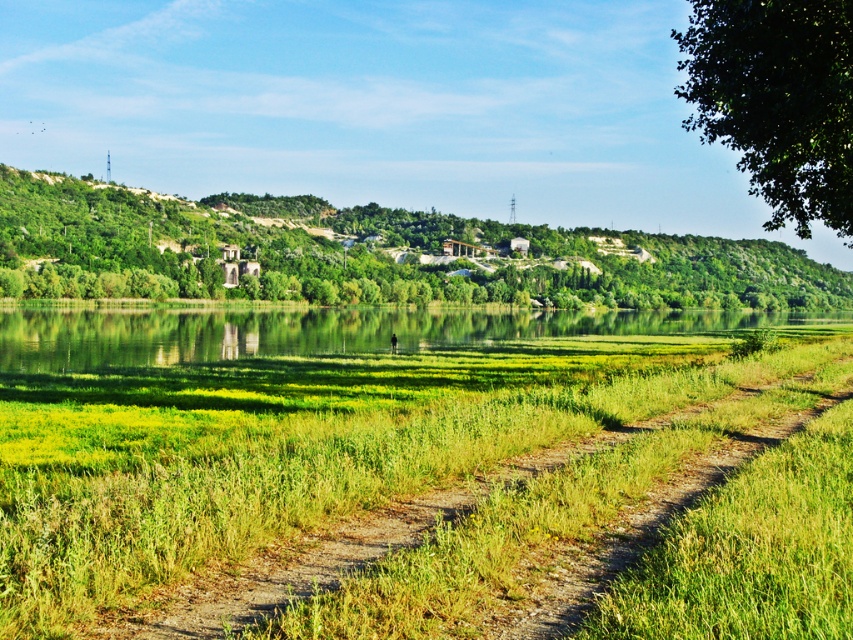
Is green leafy hill at upper center wider than green grassy river at center?

Correct, the width of green leafy hill at upper center exceeds that of green grassy river at center.

Does green leafy hill at upper center have a smaller size compared to green grassy river at center?

Actually, green leafy hill at upper center might be larger than green grassy river at center.

Who is more forward, (822, 296) or (608, 324)?

Positioned in front is point (608, 324).

Where is `green leafy hill at upper center`? The width and height of the screenshot is (853, 640). green leafy hill at upper center is located at coordinates (369, 253).

How distant is green grassy at center from green grassy river at center?

61.33 meters

Does green grassy at center lie in front of green grassy river at center?

Yes.

Does point (173, 561) come behind point (297, 317)?

That is False.

Image resolution: width=853 pixels, height=640 pixels. Identify the location of green grassy at center. (361, 484).

Which is behind, point (120, 595) or point (737, 292)?

The point (737, 292) is more distant.

Does green grassy at center appear under green leafy hill at upper center?

Correct, green grassy at center is located below green leafy hill at upper center.

Measure the distance between point (15, 492) and camera.

Point (15, 492) and camera are 8.80 meters apart.

Find the location of a particular element. The width and height of the screenshot is (853, 640). green grassy at center is located at coordinates (361, 484).